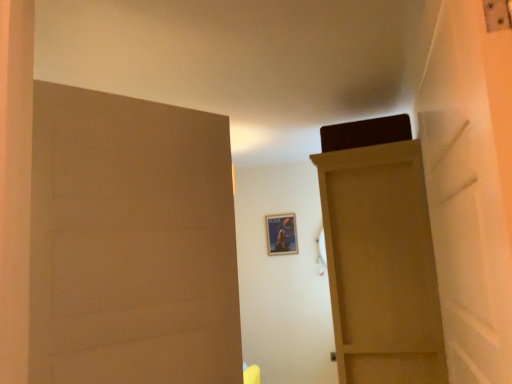
Question: Is matte wood door at upper right, arranged as the 2th door when viewed from the left, spatially inside matte wood door at left, which appears as the 1th door when viewed from the left, or outside of it?

Choices:
 (A) outside
 (B) inside

Answer: (A)

Question: Looking at their shapes, would you say matte wood door at upper right, placed as the 1th door when sorted from right to left, is wider or thinner than matte wood door at left, which appears as the 1th door when viewed from the left?

Choices:
 (A) thin
 (B) wide

Answer: (B)

Question: Which of these objects is positioned farthest from the matte wood door at left, the first door positioned from the front?

Choices:
 (A) matte wood door at upper right, arranged as the 2th door when viewed from the left
 (B) metallic poster at center

Answer: (B)

Question: Estimate the real-world distances between objects in this image. Which object is farther from the matte wood door at left, the second door when ordered from right to left?

Choices:
 (A) metallic poster at center
 (B) matte wood door at upper right, arranged as the 2th door when viewed from the front

Answer: (A)